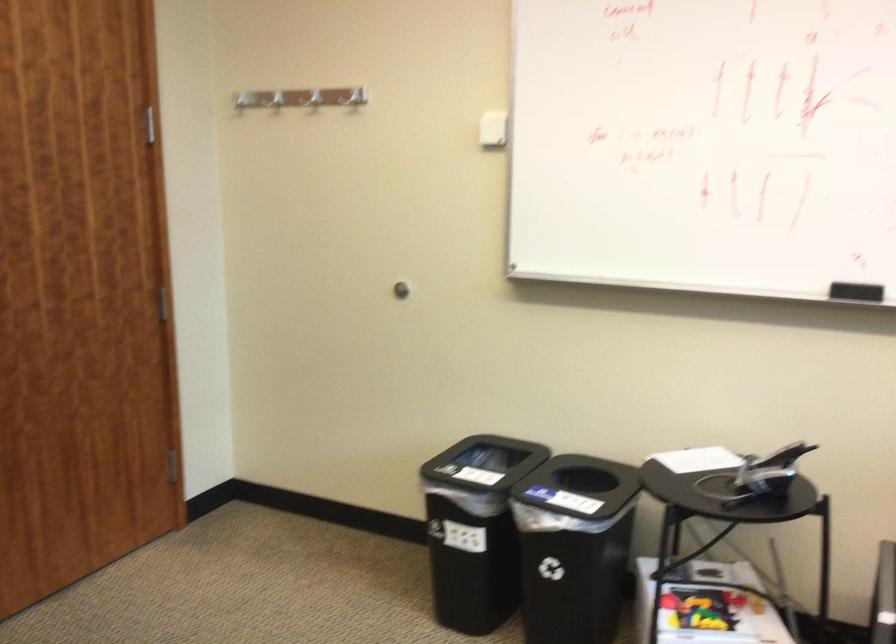
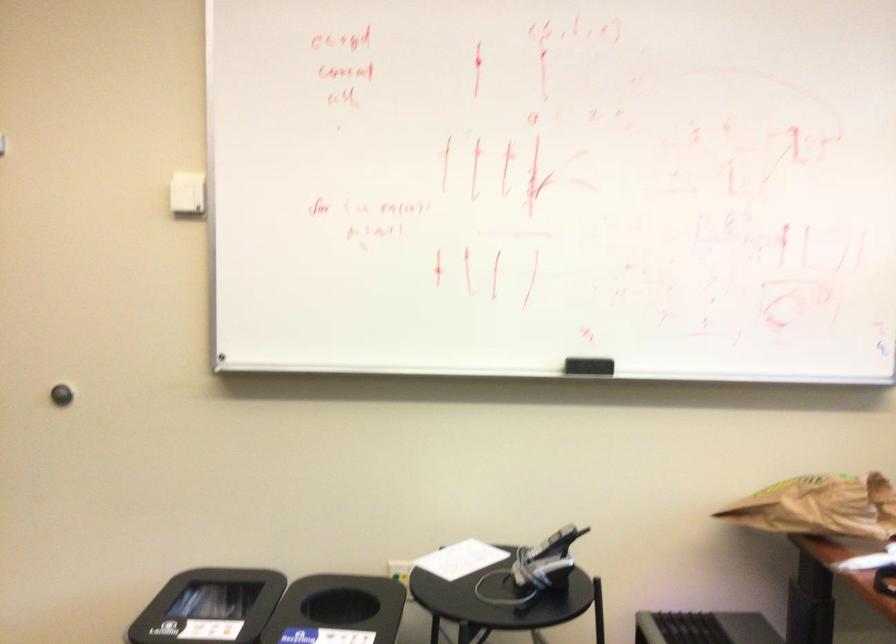
Where in the second image is the point corresponding to the point at 782,456 from the first image?

(552, 544)